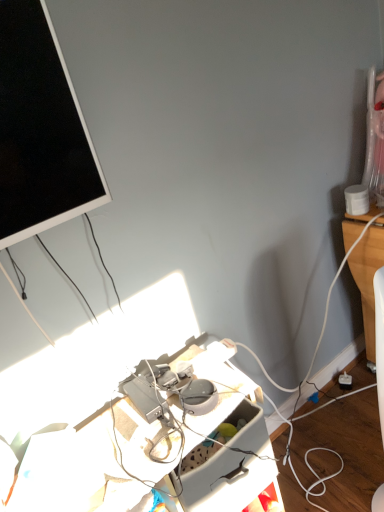
Question: From a real-world perspective, is white plastic power outlet at lower right physically located above or below matte black screen at upper left?

Choices:
 (A) below
 (B) above

Answer: (A)

Question: From the image's perspective, is white plastic power outlet at lower right positioned above or below matte black screen at upper left?

Choices:
 (A) above
 (B) below

Answer: (B)

Question: Based on their relative distances, which object is farther from the matte black screen at upper left?

Choices:
 (A) plastic gray desk at center
 (B) white plastic power outlet at lower right

Answer: (B)

Question: Which of these objects is positioned closest to the white plastic power outlet at lower right?

Choices:
 (A) plastic gray desk at center
 (B) matte black screen at upper left

Answer: (A)